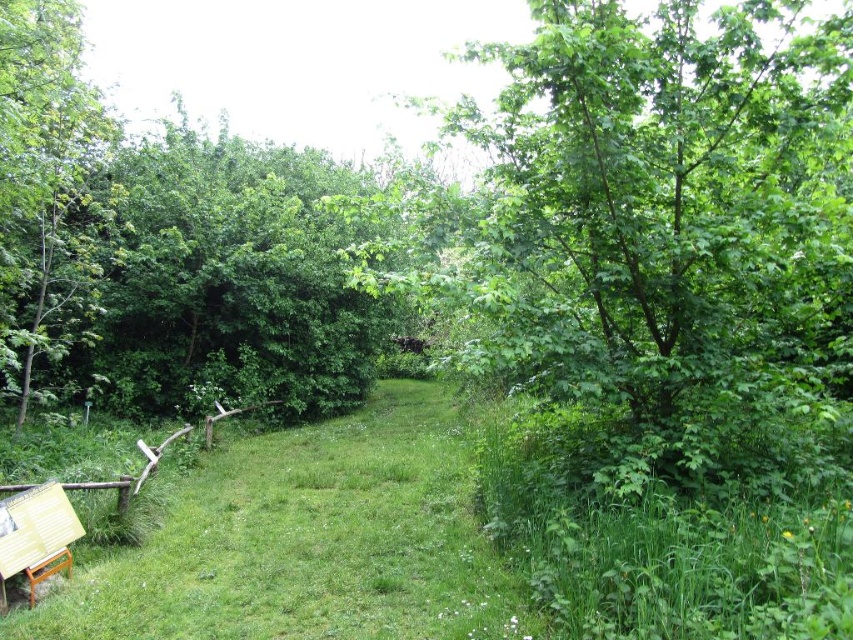
Does green leafy tree at center appear on the right side of green leafy tree at upper left?

Indeed, green leafy tree at center is positioned on the right side of green leafy tree at upper left.

You are a GUI agent. You are given a task and a screenshot of the screen. Output one action in this format:
    pyautogui.click(x=<x>, y=<y>)
    Task: Click on the green leafy tree at center
    
    Given the screenshot: What is the action you would take?
    pyautogui.click(x=648, y=236)

I want to click on green leafy tree at center, so click(x=648, y=236).

Is green grass at center smaller than green leafy tree at left?

Indeed, green grass at center has a smaller size compared to green leafy tree at left.

Is green grass at center positioned at the back of green leafy tree at left?

No, it is in front of green leafy tree at left.

The width and height of the screenshot is (853, 640). I want to click on green grass at center, so click(x=306, y=541).

Where is `green grass at center`? green grass at center is located at coordinates (306, 541).

Which of these two, green leafy tree at center or green grass at center, stands taller?

green leafy tree at center

Measure the distance between green leafy tree at center and camera.

They are 3.29 meters apart.

This screenshot has height=640, width=853. In order to click on green leafy tree at center in this screenshot , I will do `click(648, 236)`.

Where is `green leafy tree at center`? Image resolution: width=853 pixels, height=640 pixels. green leafy tree at center is located at coordinates point(648,236).